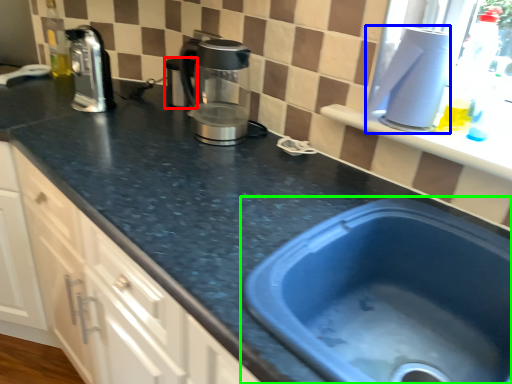
Question: Estimate the real-world distances between objects in this image. Which object is closer to appliance (highlighted by a red box), appliance (highlighted by a blue box) or sink (highlighted by a green box)?

Choices:
 (A) appliance
 (B) sink

Answer: (A)